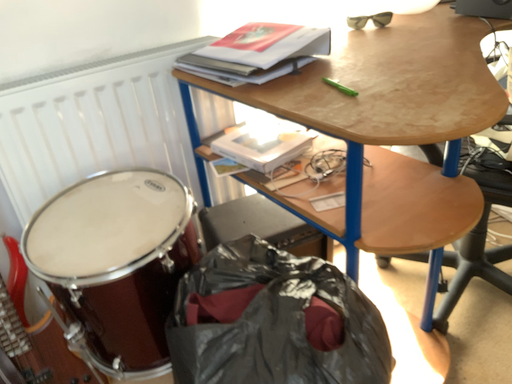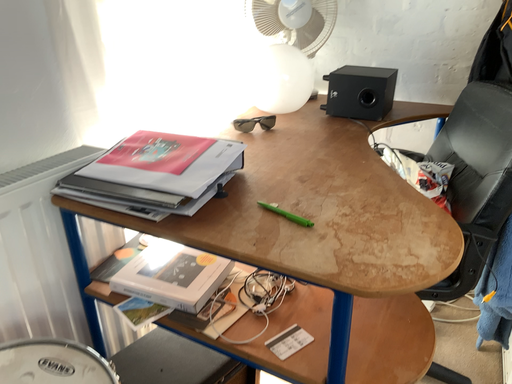
Question: How did the camera likely rotate when shooting the video?

Choices:
 (A) rotated downward
 (B) rotated upward

Answer: (B)